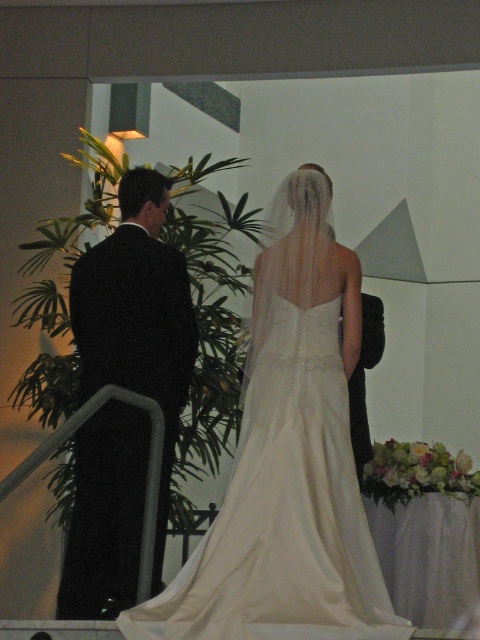
Which is more to the left, ivory satin dress at center or black suit at left?

black suit at left is more to the left.

Between ivory satin dress at center and black suit at left, which one has less height?

With less height is ivory satin dress at center.

What do you see at coordinates (284, 512) in the screenshot? I see `ivory satin dress at center` at bounding box center [284, 512].

This screenshot has width=480, height=640. Find the location of `ivory satin dress at center`. ivory satin dress at center is located at coordinates (284, 512).